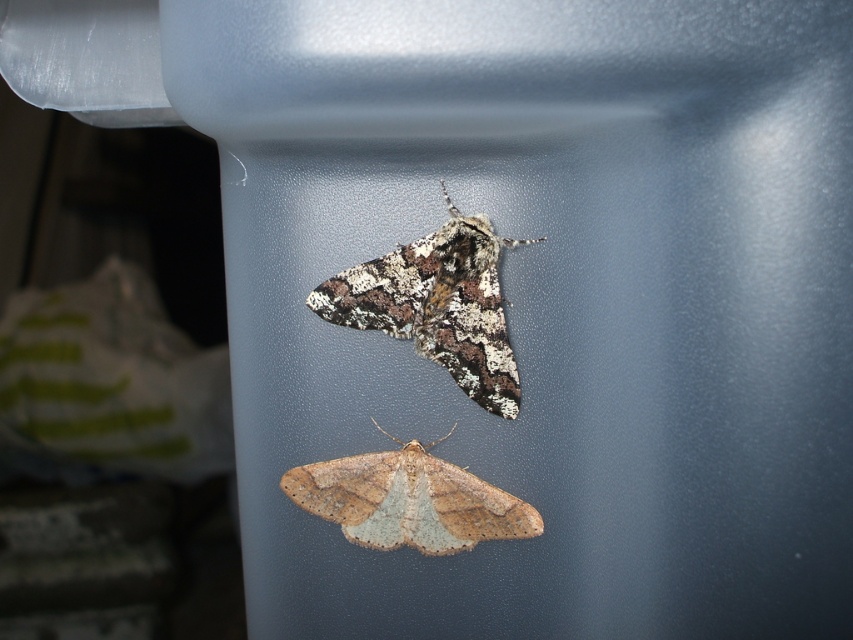
Is speckled brown moth at center thinner than brown speckled moth at center?

Correct, speckled brown moth at center's width is less than brown speckled moth at center's.

Is speckled brown moth at center closer to the viewer compared to brown speckled moth at center?

Yes, it is in front of brown speckled moth at center.

Is point (476, 240) positioned before point (331, 506)?

Yes, point (476, 240) is closer to viewer.

Identify the location of speckled brown moth at center. (437, 305).